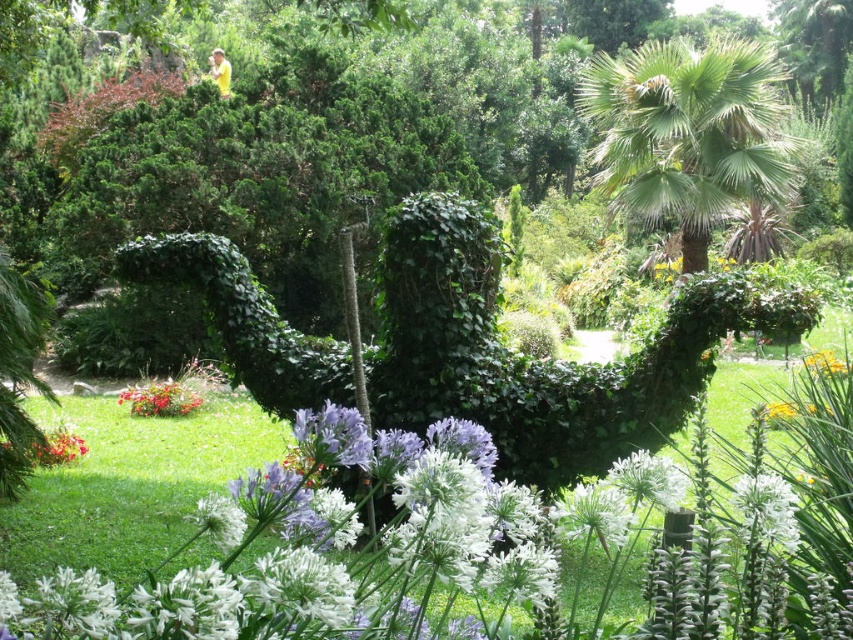
Question: Is green leafy palm at upper right below yellow/yellowish-green textured flower at lower right?

Choices:
 (A) no
 (B) yes

Answer: (A)

Question: Among these points, which one is farthest from the camera?

Choices:
 (A) (741, 70)
 (B) (151, 390)
 (C) (737, 500)

Answer: (A)

Question: Among these objects, which one is farthest from the camera?

Choices:
 (A) green leafy palm at upper right
 (B) yellow/yellowish-green/yellow-green/yellowish/green/yellow-green/yellow/green/yellow-green/yellow/yellow-green/yellow/yellow-green/yellow/yellow-green/yellow/yellow-green/yellow/yellow-green/yellow/yellow-green/yellow/yellow-green/yellow/yellow-green/yellow/yellow-green/yellow/yellow-green/yellow/yellow-green/yellow/yellow-green/yellow/yellow-green/yellow/yellow-green/yellow/yellow-green/yellow/yellow-green/yellow/yellow-green/yellow/yellow-green/yellow/yellow-green/yellow/yellow-green/yellow/yellow-green
 (C) white matte flower at lower center

Answer: (A)

Question: Does white matte flower at center have a greater width compared to bright red petals at lower left?

Choices:
 (A) yes
 (B) no

Answer: (B)

Question: Can you confirm if white matte flower at center is positioned below yellow/yellowish-green textured flower at lower right?

Choices:
 (A) yes
 (B) no

Answer: (B)

Question: Which point appears farthest from the camera in this image?

Choices:
 (A) (198, 396)
 (B) (828, 374)

Answer: (A)